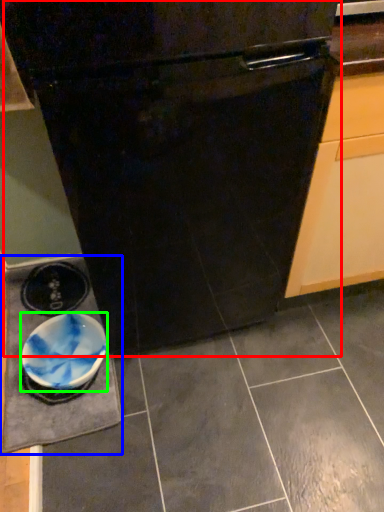
Question: Considering the real-world distances, which object is closest to oven (highlighted by a red box)? slate (highlighted by a blue box) or bowl (highlighted by a green box).

Choices:
 (A) slate
 (B) bowl

Answer: (B)